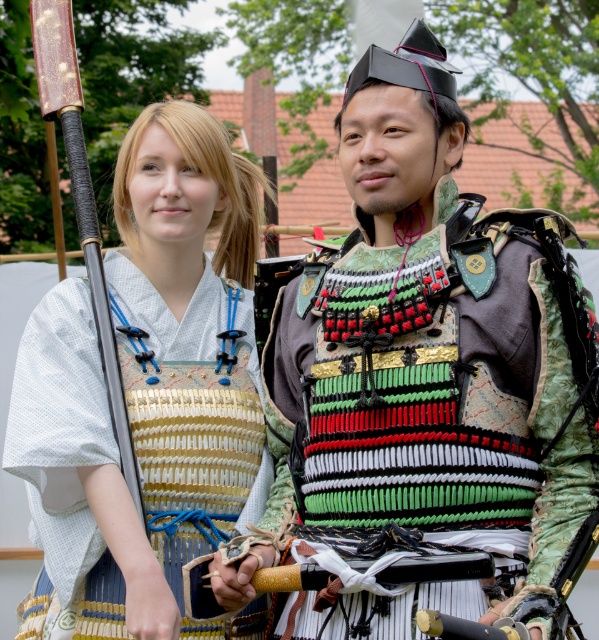
In the scene shown: Which is above, knitted fabric armor at center or matte gold armor at center?

Positioned higher is matte gold armor at center.

Does knitted fabric armor at center appear over matte gold armor at center?

No, knitted fabric armor at center is not above matte gold armor at center.

You are a GUI agent. You are given a task and a screenshot of the screen. Output one action in this format:
    pyautogui.click(x=<x>, y=<y>)
    Task: Click on the knitted fabric armor at center
    
    Given the screenshot: What is the action you would take?
    pyautogui.click(x=437, y=397)